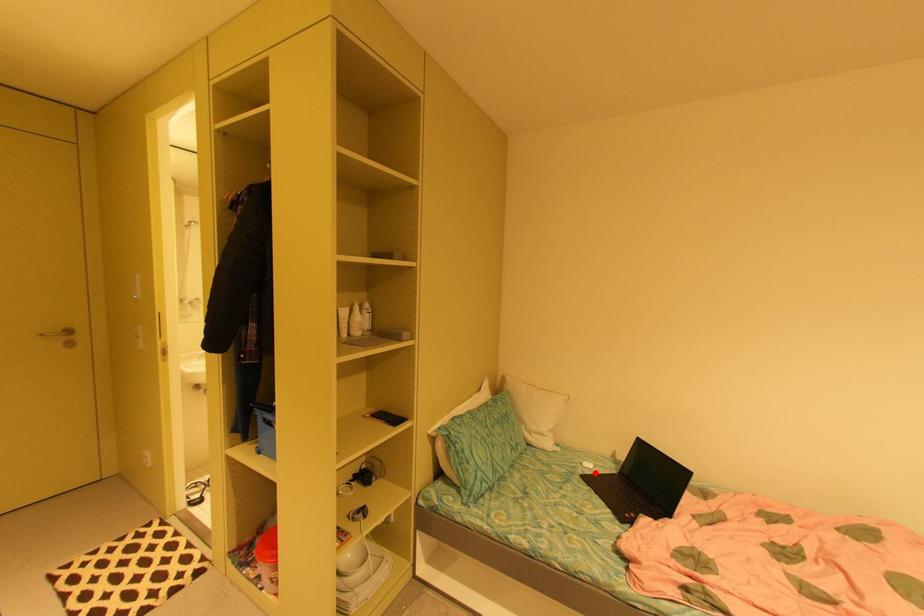
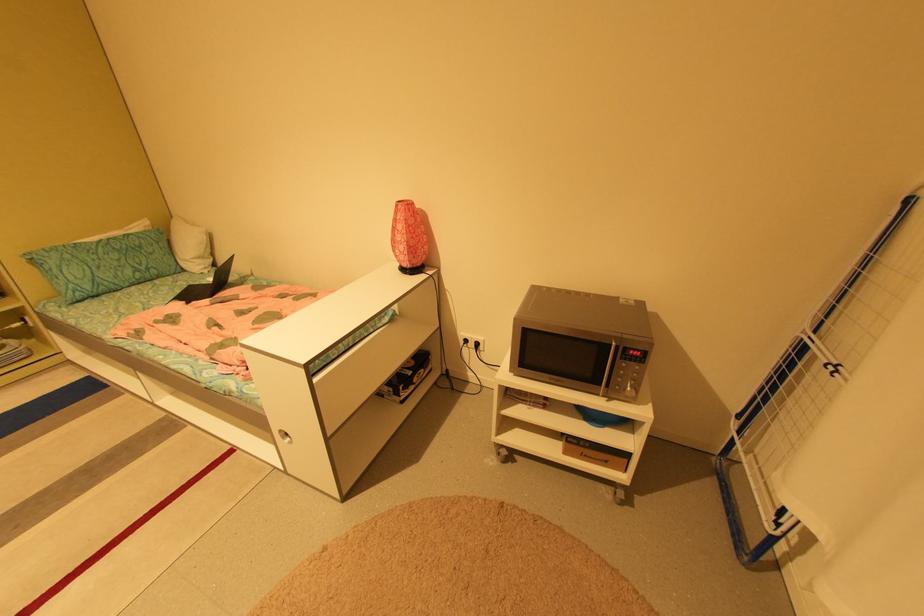
The point at the highlighted location is marked in the first image. Where is the corresponding point in the second image?

(210, 284)